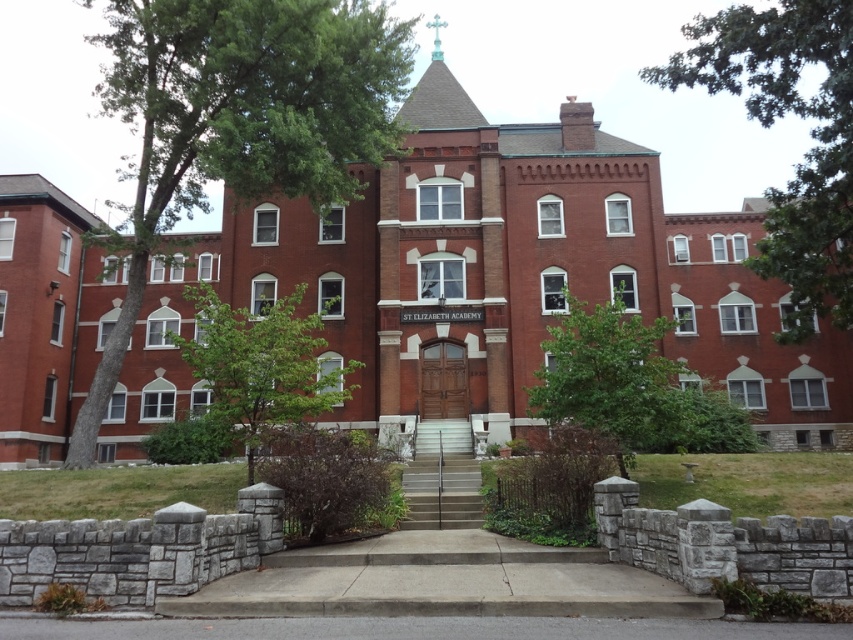
Does brick church at center appear over green leafy tree at center?

Indeed, brick church at center is positioned over green leafy tree at center.

Can you confirm if brick church at center is shorter than green leafy tree at center?

Incorrect, brick church at center's height does not fall short of green leafy tree at center's.

The image size is (853, 640). What do you see at coordinates (525, 269) in the screenshot?
I see `brick church at center` at bounding box center [525, 269].

The width and height of the screenshot is (853, 640). I want to click on brick church at center, so click(525, 269).

Can you confirm if brick church at center is bigger than green leafy tree at lower left?

Yes, brick church at center is bigger than green leafy tree at lower left.

Does brick church at center have a greater width compared to green leafy tree at lower left?

Correct, the width of brick church at center exceeds that of green leafy tree at lower left.

Which is in front, point (491, 186) or point (223, 305)?

Point (223, 305) is more forward.

Locate an element on the screen. This screenshot has height=640, width=853. brick church at center is located at coordinates (525, 269).

Consider the image. Can you confirm if green leafy tree at left is positioned below green leafy tree at lower left?

No.

Is point (108, 96) in front of point (311, 380)?

No, it is behind (311, 380).

The image size is (853, 640). What are the coordinates of `green leafy tree at left` in the screenshot? It's located at (239, 120).